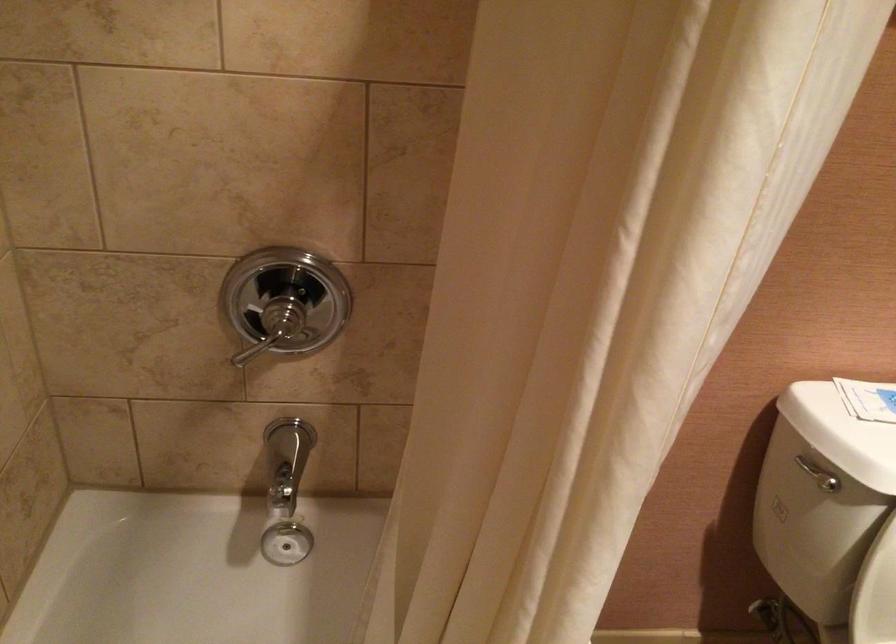
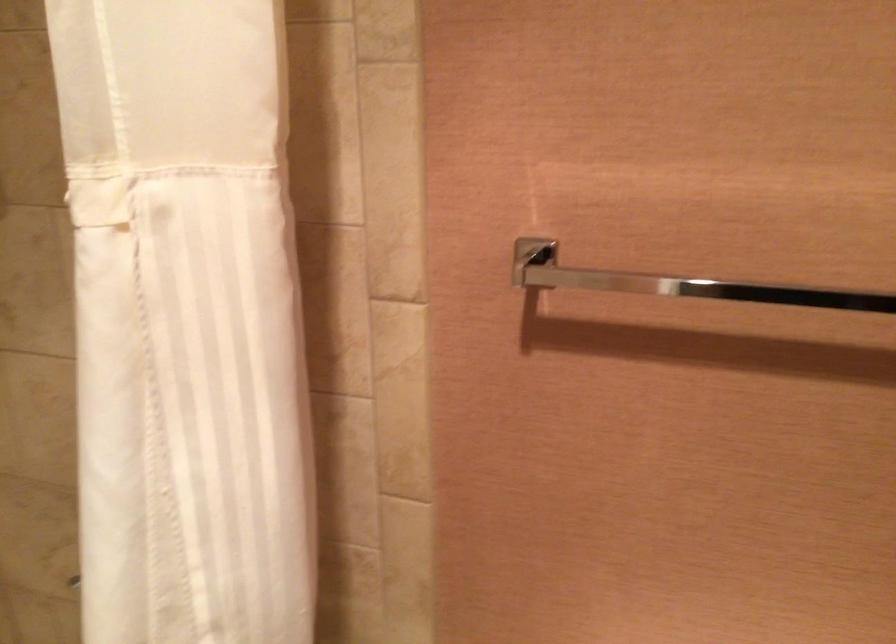
Question: What movement of the cameraman would produce the second image?

Choices:
 (A) Left
 (B) Right
 (C) Forward
 (D) Backward

Answer: (B)